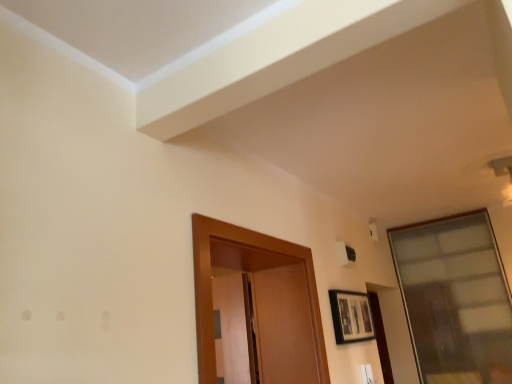
Question: Can you confirm if matte black picture frame at lower right is wider than transparent glass window at upper right?

Choices:
 (A) no
 (B) yes

Answer: (A)

Question: From a real-world perspective, is matte black picture frame at lower right located beneath transparent glass window at upper right?

Choices:
 (A) no
 (B) yes

Answer: (B)

Question: From a real-world perspective, is matte black picture frame at lower right on top of transparent glass window at upper right?

Choices:
 (A) yes
 (B) no

Answer: (B)

Question: Is the depth of matte black picture frame at lower right greater than that of transparent glass window at upper right?

Choices:
 (A) no
 (B) yes

Answer: (A)

Question: Is matte black picture frame at lower right turned away from transparent glass window at upper right?

Choices:
 (A) yes
 (B) no

Answer: (B)

Question: Is transparent glass window at upper right surrounded by matte black picture frame at lower right?

Choices:
 (A) no
 (B) yes

Answer: (A)

Question: Considering the relative positions of transparent glass window at upper right and matte black picture frame at lower right in the image provided, is transparent glass window at upper right in front of matte black picture frame at lower right?

Choices:
 (A) no
 (B) yes

Answer: (A)

Question: Considering the relative positions of transparent glass window at upper right and matte black picture frame at lower right in the image provided, is transparent glass window at upper right to the left of matte black picture frame at lower right from the viewer's perspective?

Choices:
 (A) no
 (B) yes

Answer: (A)

Question: Is transparent glass window at upper right turned away from matte black picture frame at lower right?

Choices:
 (A) no
 (B) yes

Answer: (A)

Question: Is transparent glass window at upper right smaller than matte black picture frame at lower right?

Choices:
 (A) no
 (B) yes

Answer: (A)

Question: Is transparent glass window at upper right far away from matte black picture frame at lower right?

Choices:
 (A) no
 (B) yes

Answer: (B)

Question: Does transparent glass window at upper right come behind matte black picture frame at lower right?

Choices:
 (A) no
 (B) yes

Answer: (B)

Question: Considering the positions of transparent glass window at upper right and matte black picture frame at lower right in the image, is transparent glass window at upper right taller or shorter than matte black picture frame at lower right?

Choices:
 (A) tall
 (B) short

Answer: (A)